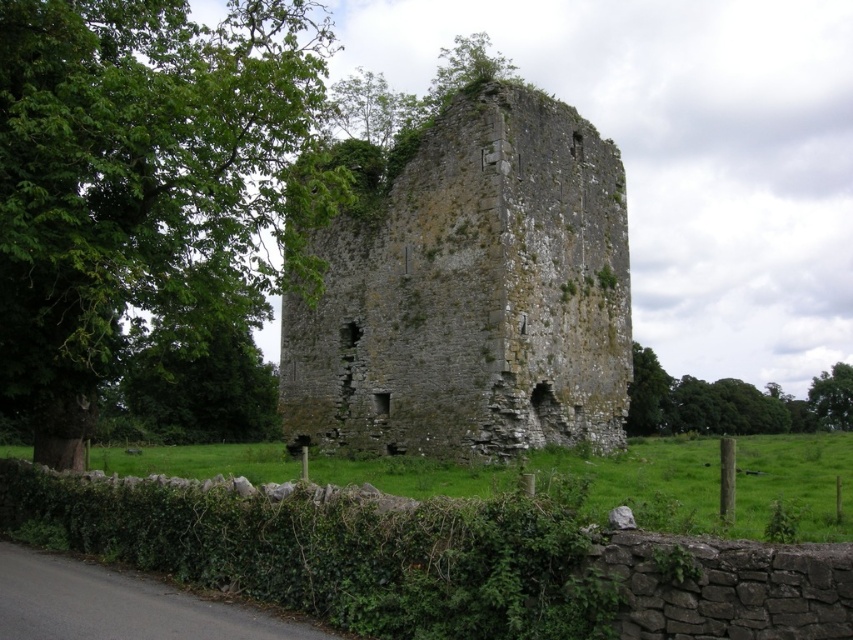
Question: Can you confirm if green leafy tree at upper left is smaller than green leafy tree at right?

Choices:
 (A) no
 (B) yes

Answer: (A)

Question: Which point is closer to the camera taking this photo?

Choices:
 (A) (837, 365)
 (B) (738, 426)
 (C) (6, 227)

Answer: (C)

Question: Considering the relative positions of green leafy tree at right and green leafy tree at upper center in the image provided, where is green leafy tree at right located with respect to green leafy tree at upper center?

Choices:
 (A) above
 (B) below

Answer: (A)

Question: Which point is farther to the camera?

Choices:
 (A) green leafy tree at right
 (B) green leafy tree at upper left
 (C) stone tower at center

Answer: (A)

Question: Which point is farther to the camera?

Choices:
 (A) (550, 204)
 (B) (158, 316)
 (C) (817, 420)

Answer: (C)

Question: Is green leafy tree at right wider than green leafy tree at upper center?

Choices:
 (A) yes
 (B) no

Answer: (A)